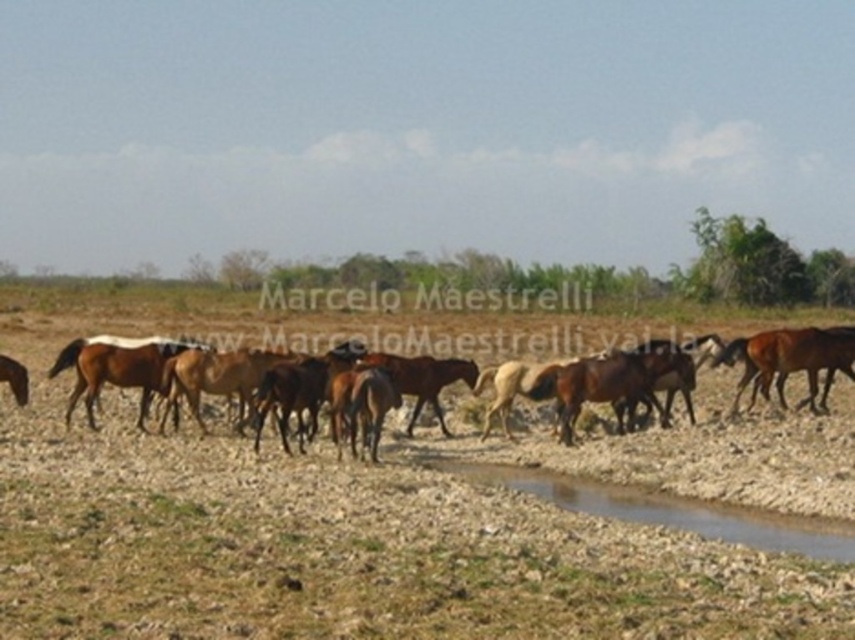
You are a photographer trying to capture a photo of the brown glossy horse at left and the brown glossy horse at center. From your current position, which horse is positioned to your right side?

The brown glossy horse at left is positioned to the right of the brown glossy horse at center, so if you are facing the scene, the brown glossy horse at left would be on your right side.